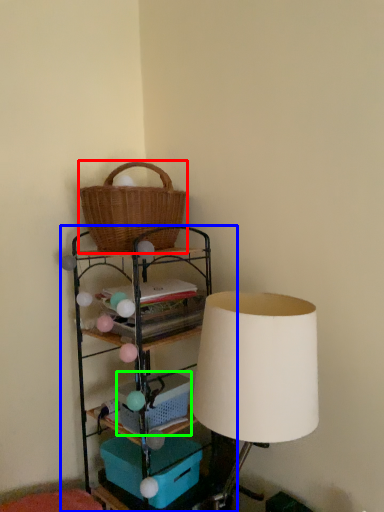
Question: Which is nearer to the picnic basket (highlighted by a red box)? shelf (highlighted by a blue box) or basket (highlighted by a green box).

Choices:
 (A) shelf
 (B) basket

Answer: (A)